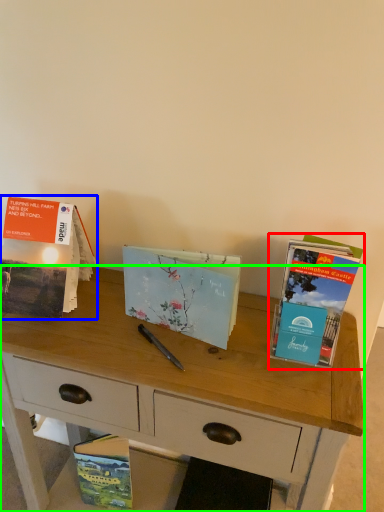
Question: Considering the real-world distances, which object is farthest from book (highlighted by a red box)? book (highlighted by a blue box) or desk (highlighted by a green box)?

Choices:
 (A) book
 (B) desk

Answer: (A)